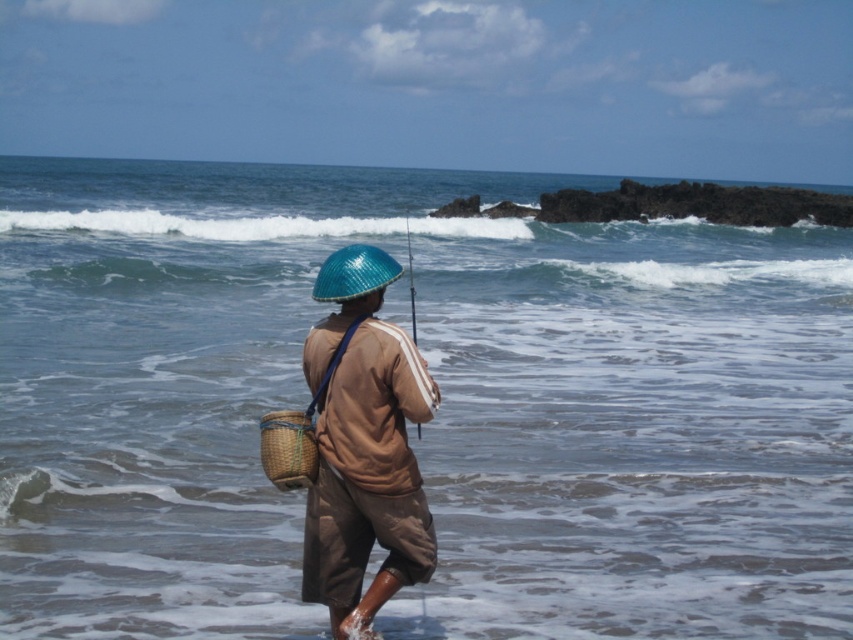
Question: Which of the following is the closest to the observer?

Choices:
 (A) brown woven basket at center
 (B) woven brown basket at lower left

Answer: (A)

Question: Does brown woven basket at center appear over woven brown basket at lower left?

Choices:
 (A) no
 (B) yes

Answer: (A)

Question: Can you confirm if brown woven basket at center is positioned above woven brown basket at lower left?

Choices:
 (A) yes
 (B) no

Answer: (B)

Question: Is brown woven basket at center to the left of woven brown basket at lower left from the viewer's perspective?

Choices:
 (A) no
 (B) yes

Answer: (A)

Question: Which point is farther to the camera?

Choices:
 (A) woven brown basket at lower left
 (B) brown woven basket at center

Answer: (A)

Question: Which of the following is the farthest from the observer?

Choices:
 (A) woven brown basket at lower left
 (B) brown woven basket at center

Answer: (A)